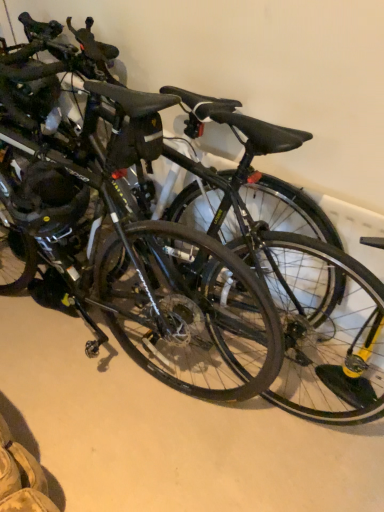
Locate an element on the screen. black rubber tire at center, acting as the 2th bicycle wheel starting from the left is located at coordinates (288, 209).

This screenshot has width=384, height=512. Identify the location of concrete on the left of the black rubber tire at center, acting as the first bicycle wheel starting from the right. (165, 433).

Looking at their sizes, would you say black matte bicycle at center is wider or thinner than black rubber tire at center, acting as the first bicycle wheel starting from the right?

Clearly, black matte bicycle at center has more width compared to black rubber tire at center, acting as the first bicycle wheel starting from the right.

Would you say black matte bicycle at center contains black rubber tire at center, acting as the 2th bicycle wheel starting from the left?

No, black rubber tire at center, acting as the 2th bicycle wheel starting from the left, is not a part of black matte bicycle at center.

From the image's perspective, is black matte bicycle at center below black rubber tire at center, acting as the first bicycle wheel starting from the right?

Yes, from the image's perspective, black matte bicycle at center is below black rubber tire at center, acting as the first bicycle wheel starting from the right.

Is black rubber tire at center, acting as the first bicycle wheel starting from the right, spatially inside matte black helmet at left, acting as the second bicycle wheel starting from the right, or outside of it?

black rubber tire at center, acting as the first bicycle wheel starting from the right, cannot be found inside matte black helmet at left, acting as the second bicycle wheel starting from the right.

Who is smaller, black rubber tire at center, acting as the first bicycle wheel starting from the right, or matte black helmet at left, which ranks as the first bicycle wheel in left-to-right order?

matte black helmet at left, which ranks as the first bicycle wheel in left-to-right order, is smaller.

Which object is wider, black rubber tire at center, acting as the 2th bicycle wheel starting from the left, or matte black helmet at left, acting as the second bicycle wheel starting from the right?

matte black helmet at left, acting as the second bicycle wheel starting from the right, is wider.

This screenshot has height=512, width=384. What are the coordinates of `bicycle wheel on the left of black rubber tire at center, acting as the first bicycle wheel starting from the right` in the screenshot? It's located at (41, 214).

Would you consider black rubber tire at center, acting as the 2th bicycle wheel starting from the left, to be distant from black matte bicycle at center?

black rubber tire at center, acting as the 2th bicycle wheel starting from the left, is near black matte bicycle at center, not far away.

Considering their positions, is black rubber tire at center, acting as the first bicycle wheel starting from the right, located in front of or behind black matte bicycle at center?

In the image, black rubber tire at center, acting as the first bicycle wheel starting from the right, appears behind black matte bicycle at center.

Between black rubber tire at center, acting as the first bicycle wheel starting from the right, and black matte bicycle at center, which one has less height?

With less height is black matte bicycle at center.

Is black rubber tire at center, acting as the 2th bicycle wheel starting from the left, oriented away from black matte bicycle at center?

black rubber tire at center, acting as the 2th bicycle wheel starting from the left, is not turned away from black matte bicycle at center.

From the picture: Are matte black helmet at left, acting as the second bicycle wheel starting from the right, and black rubber tire at center, acting as the first bicycle wheel starting from the right, making contact?

They are not placed beside each other.

Based on the photo, from a real-world perspective, is matte black helmet at left, which ranks as the first bicycle wheel in left-to-right order, located beneath black rubber tire at center, acting as the first bicycle wheel starting from the right?

Incorrect, from a real-world perspective, matte black helmet at left, which ranks as the first bicycle wheel in left-to-right order, is higher than black rubber tire at center, acting as the first bicycle wheel starting from the right.

How distant is matte black helmet at left, which ranks as the first bicycle wheel in left-to-right order, from black rubber tire at center, acting as the first bicycle wheel starting from the right?

matte black helmet at left, which ranks as the first bicycle wheel in left-to-right order, and black rubber tire at center, acting as the first bicycle wheel starting from the right, are 20.02 inches apart from each other.

Which is more to the left, matte black helmet at left, which ranks as the first bicycle wheel in left-to-right order, or black rubber tire at center, acting as the first bicycle wheel starting from the right?

From the viewer's perspective, matte black helmet at left, which ranks as the first bicycle wheel in left-to-right order, appears more on the left side.

Is black rubber tire at center, acting as the 2th bicycle wheel starting from the left, located outside glossy black bicycle at center?

No, most part of black rubber tire at center, acting as the 2th bicycle wheel starting from the left, lies within glossy black bicycle at center.

Could you measure the distance between black rubber tire at center, acting as the first bicycle wheel starting from the right, and glossy black bicycle at center?

A distance of 10.11 inches exists between black rubber tire at center, acting as the first bicycle wheel starting from the right, and glossy black bicycle at center.

In terms of height, does black rubber tire at center, acting as the 2th bicycle wheel starting from the left, look taller or shorter compared to glossy black bicycle at center?

Clearly, black rubber tire at center, acting as the 2th bicycle wheel starting from the left, is shorter compared to glossy black bicycle at center.

Consider the image. Is black rubber tire at center, acting as the first bicycle wheel starting from the right, bigger than glossy black bicycle at center?

No, black rubber tire at center, acting as the first bicycle wheel starting from the right, is not bigger than glossy black bicycle at center.

Considering their positions, is matte black helmet at left, which ranks as the first bicycle wheel in left-to-right order, located in front of or behind glossy black bicycle at center?

matte black helmet at left, which ranks as the first bicycle wheel in left-to-right order, is behind glossy black bicycle at center.

Which of these two, matte black helmet at left, acting as the second bicycle wheel starting from the right, or glossy black bicycle at center, stands shorter?

With less height is matte black helmet at left, acting as the second bicycle wheel starting from the right.

Would you say matte black helmet at left, which ranks as the first bicycle wheel in left-to-right order, contains glossy black bicycle at center?

No, matte black helmet at left, which ranks as the first bicycle wheel in left-to-right order, does not contain glossy black bicycle at center.

Is matte black helmet at left, which ranks as the first bicycle wheel in left-to-right order, wider than glossy black bicycle at center?

No, matte black helmet at left, which ranks as the first bicycle wheel in left-to-right order, is not wider than glossy black bicycle at center.

From the image's perspective, is black matte bicycle at center on glossy black bicycle at center?

Actually, black matte bicycle at center appears below glossy black bicycle at center in the image.

Does point (97, 417) appear closer or farther from the camera than point (43, 145)?

Clearly, point (97, 417) is more distant from the camera than point (43, 145).

In order to click on bicycle in front of the black matte bicycle at center in this screenshot , I will do `click(147, 187)`.

Where is `concrete below the black rubber tire at center, acting as the first bicycle wheel starting from the right (from the image's perspective)`? concrete below the black rubber tire at center, acting as the first bicycle wheel starting from the right (from the image's perspective) is located at coordinates (165, 433).

Find the location of a particular element. bicycle wheel located underneath the matte black helmet at left, acting as the second bicycle wheel starting from the right (from a real-world perspective) is located at coordinates (288, 209).

Based on their spatial positions, is black matte bicycle at center or black rubber tire at center, acting as the 2th bicycle wheel starting from the left, closer to matte black helmet at left, acting as the second bicycle wheel starting from the right?

black rubber tire at center, acting as the 2th bicycle wheel starting from the left, is closer to matte black helmet at left, acting as the second bicycle wheel starting from the right.

From the picture: Looking at the image, which one is located further to black matte bicycle at center, matte black helmet at left, acting as the second bicycle wheel starting from the right, or glossy black bicycle at center?

Based on the image, matte black helmet at left, acting as the second bicycle wheel starting from the right, appears to be further to black matte bicycle at center.

Considering their positions, is matte black helmet at left, which ranks as the first bicycle wheel in left-to-right order, positioned closer to glossy black bicycle at center than black rubber tire at center, acting as the 2th bicycle wheel starting from the left?

Among the two, matte black helmet at left, which ranks as the first bicycle wheel in left-to-right order, is located nearer to glossy black bicycle at center.

Based on their spatial positions, is black matte bicycle at center or matte black helmet at left, which ranks as the first bicycle wheel in left-to-right order, closer to black rubber tire at center, acting as the 2th bicycle wheel starting from the left?

matte black helmet at left, which ranks as the first bicycle wheel in left-to-right order.

When comparing their distances from black rubber tire at center, acting as the first bicycle wheel starting from the right, does glossy black bicycle at center or black matte bicycle at center seem further?

The object further to black rubber tire at center, acting as the first bicycle wheel starting from the right, is black matte bicycle at center.

When comparing their distances from matte black helmet at left, which ranks as the first bicycle wheel in left-to-right order, does glossy black bicycle at center or black rubber tire at center, acting as the first bicycle wheel starting from the right, seem further?

black rubber tire at center, acting as the first bicycle wheel starting from the right.

Which object lies further to the anchor point black matte bicycle at center, glossy black bicycle at center or black rubber tire at center, acting as the 2th bicycle wheel starting from the left?

Among the two, black rubber tire at center, acting as the 2th bicycle wheel starting from the left, is located further to black matte bicycle at center.

Which object lies further to the anchor point matte black helmet at left, which ranks as the first bicycle wheel in left-to-right order, black rubber tire at center, acting as the 2th bicycle wheel starting from the left, or glossy black bicycle at center?

Based on the image, black rubber tire at center, acting as the 2th bicycle wheel starting from the left, appears to be further to matte black helmet at left, which ranks as the first bicycle wheel in left-to-right order.

What are the coordinates of `bicycle situated between matte black helmet at left, acting as the second bicycle wheel starting from the right, and black rubber tire at center, acting as the 2th bicycle wheel starting from the left, from left to right` in the screenshot? It's located at (147, 187).

I want to click on bicycle between black matte bicycle at center and black rubber tire at center, acting as the 2th bicycle wheel starting from the left, in the horizontal direction, so click(147, 187).

Where is `concrete between matte black helmet at left, acting as the second bicycle wheel starting from the right, and black rubber tire at center, acting as the first bicycle wheel starting from the right, from left to right`? This screenshot has height=512, width=384. concrete between matte black helmet at left, acting as the second bicycle wheel starting from the right, and black rubber tire at center, acting as the first bicycle wheel starting from the right, from left to right is located at coordinates (165, 433).